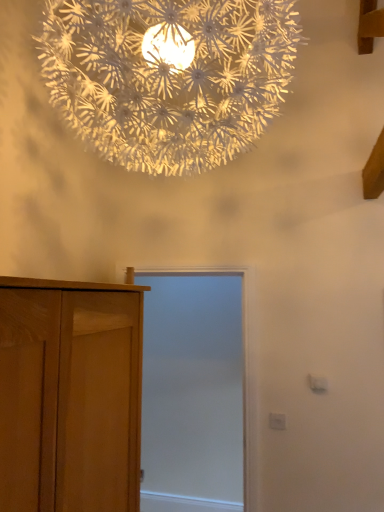
Question: Should I look upward or downward to see white paper-like at upper center?

Choices:
 (A) down
 (B) up

Answer: (B)

Question: Is white paper-like at upper center turned away from white matte screen door at center?

Choices:
 (A) no
 (B) yes

Answer: (A)

Question: Is white paper-like at upper center placed right next to white matte screen door at center?

Choices:
 (A) yes
 (B) no

Answer: (B)

Question: From a real-world perspective, is white paper-like at upper center on white matte screen door at center?

Choices:
 (A) yes
 (B) no

Answer: (A)

Question: Is white paper-like at upper center far away from white matte screen door at center?

Choices:
 (A) no
 (B) yes

Answer: (B)

Question: Is white paper-like at upper center surrounding white matte screen door at center?

Choices:
 (A) no
 (B) yes

Answer: (A)

Question: From a real-world perspective, is white paper-like at upper center positioned under white matte screen door at center based on gravity?

Choices:
 (A) no
 (B) yes

Answer: (A)

Question: Is white paper-like at upper center smaller than light brown wooden cupboard at left?

Choices:
 (A) no
 (B) yes

Answer: (A)

Question: Is white paper-like at upper center not within light brown wooden cupboard at left?

Choices:
 (A) no
 (B) yes

Answer: (B)

Question: Considering the relative positions of white paper-like at upper center and light brown wooden cupboard at left in the image provided, is white paper-like at upper center to the right of light brown wooden cupboard at left from the viewer's perspective?

Choices:
 (A) yes
 (B) no

Answer: (A)

Question: From the image's perspective, does white paper-like at upper center appear lower than light brown wooden cupboard at left?

Choices:
 (A) no
 (B) yes

Answer: (A)

Question: Does white paper-like at upper center come in front of light brown wooden cupboard at left?

Choices:
 (A) yes
 (B) no

Answer: (B)

Question: Is white paper-like at upper center far away from light brown wooden cupboard at left?

Choices:
 (A) yes
 (B) no

Answer: (B)

Question: Is light brown wooden cupboard at left completely or partially outside of white matte screen door at center?

Choices:
 (A) no
 (B) yes

Answer: (B)